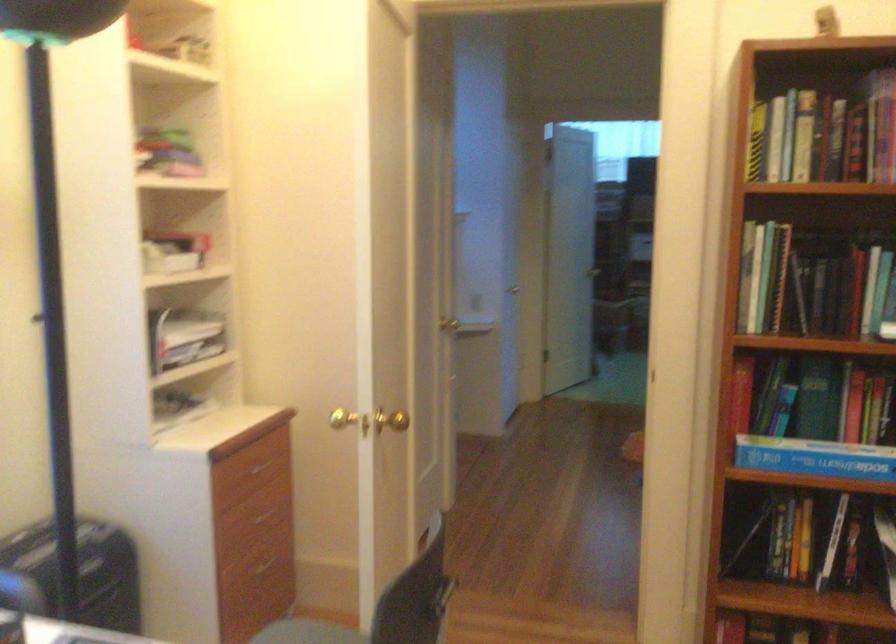
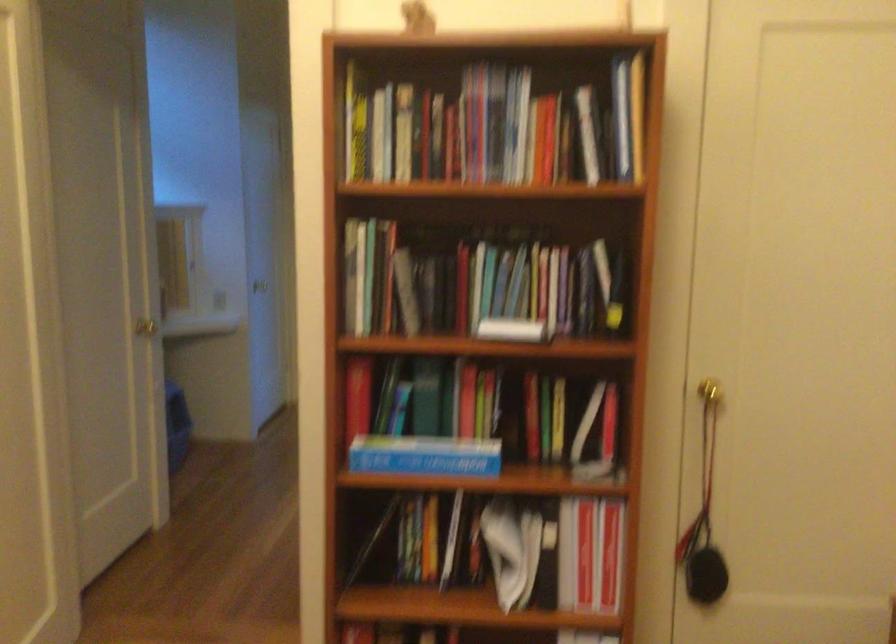
Question: Based on the continuous images, in which direction is the camera rotating? Reply with the corresponding letter.

Choices:
 (A) Left
 (B) Right
 (C) Up
 (D) Down

Answer: (B)